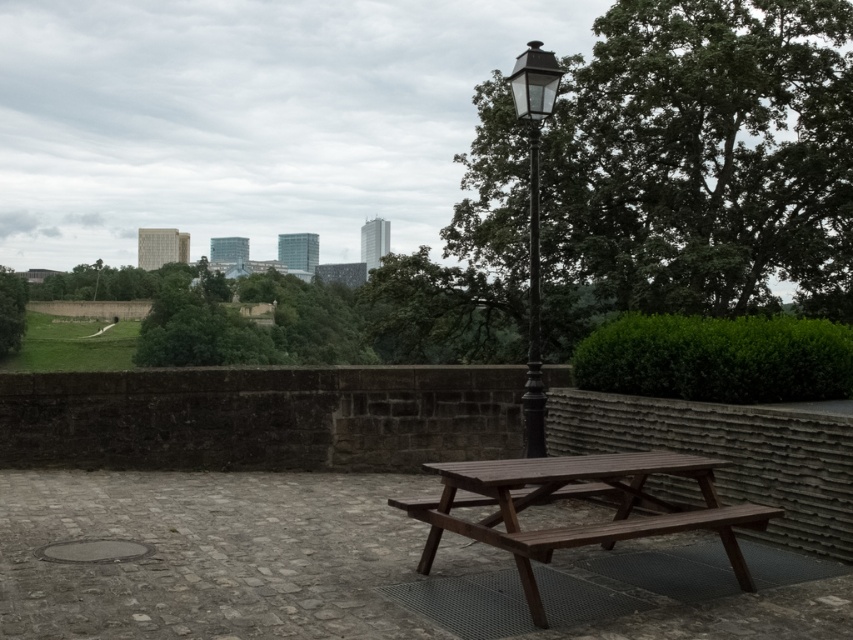
You are standing at the origin point of the coordinate system in the image. You want to walk to the brown wooden table at center. Which direction should you move in terms of x and y coordinates?

The brown wooden table at center is located at coordinates x 0.778 and y 0.678, so you should move in the positive x and positive y direction to reach it.